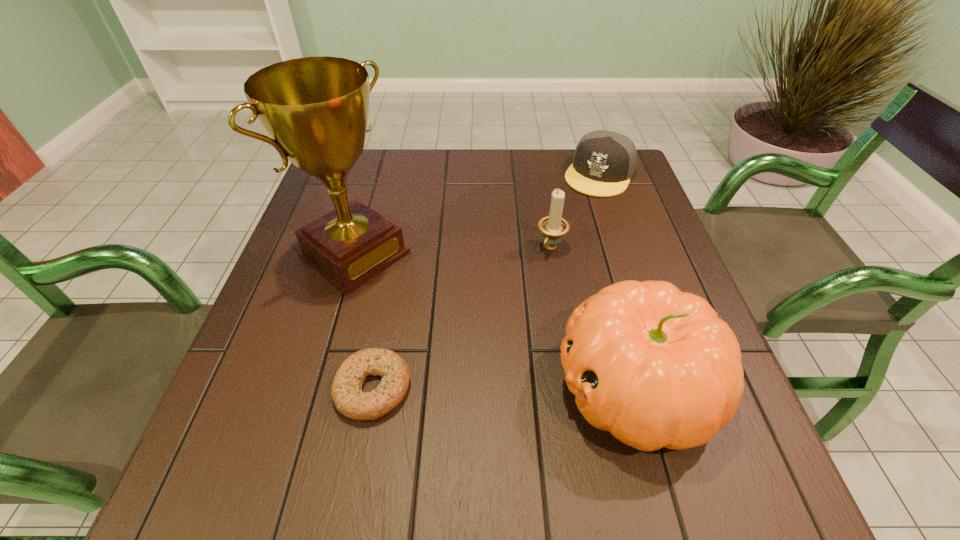
I want to click on vacant area situated on the handle side of the third tallest object, so click(531, 284).

Image resolution: width=960 pixels, height=540 pixels. In order to click on free location located 0.390m on the handle side of the third tallest object in this screenshot , I will do `click(466, 393)`.

I want to click on free space located on the handle side of the third tallest object, so click(523, 296).

This screenshot has height=540, width=960. I want to click on vacant area situated on the front-facing side of the second shortest object, so click(x=545, y=268).

The height and width of the screenshot is (540, 960). Identify the location of vacant space located on the front-facing side of the second shortest object. (532, 291).

I want to click on free space located on the front-facing side of the second shortest object, so click(x=564, y=238).

Image resolution: width=960 pixels, height=540 pixels. I want to click on vacant space located on the plaque of the tallest object, so click(x=471, y=345).

You are a GUI agent. You are given a task and a screenshot of the screen. Output one action in this format:
    pyautogui.click(x=<x>, y=<y>)
    Task: Click on the free space located on the plaque of the tallest object
    This screenshot has width=960, height=540.
    Given the screenshot: What is the action you would take?
    pyautogui.click(x=475, y=348)

This screenshot has width=960, height=540. I want to click on blank space located 0.320m on the plaque of the tallest object, so click(x=498, y=366).

Locate an element on the screen. This screenshot has width=960, height=540. object that is at the far edge is located at coordinates (604, 161).